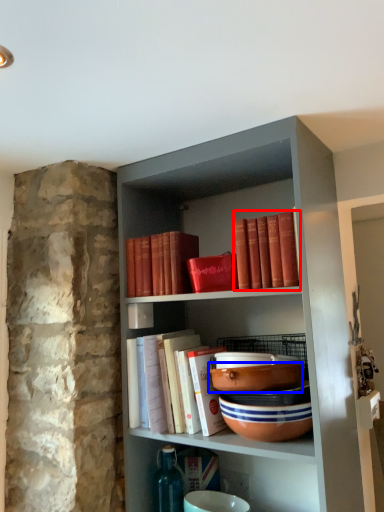
Question: Which point is closer to the camera, book (highlighted by a red box) or bowl (highlighted by a blue box)?

Choices:
 (A) book
 (B) bowl

Answer: (A)